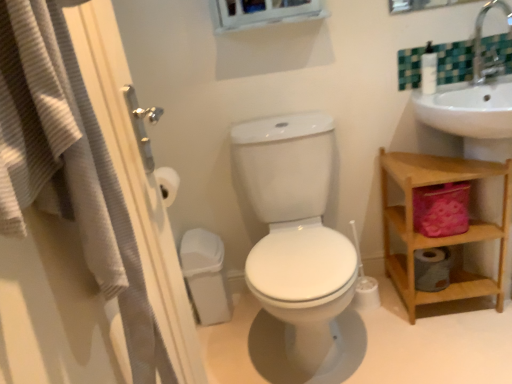
Where is `vacant space to the right of white plastic soap dispenser at upper right`? Image resolution: width=512 pixels, height=384 pixels. vacant space to the right of white plastic soap dispenser at upper right is located at coordinates (464, 86).